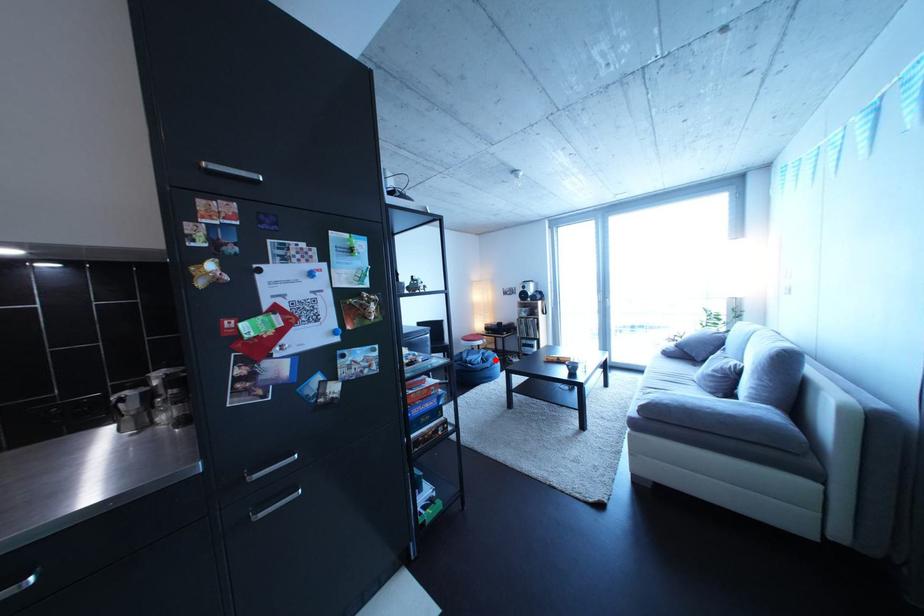
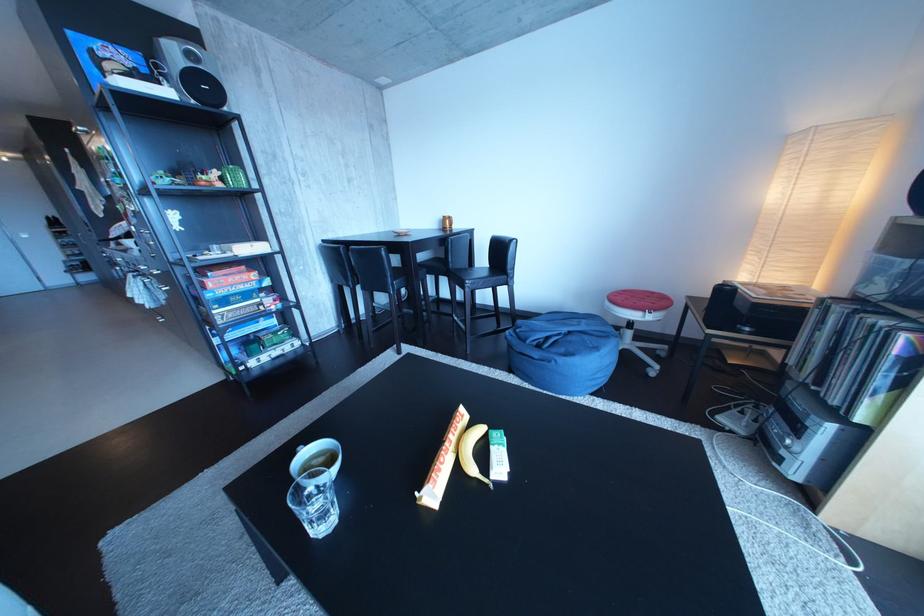
The point at the highlighted location is marked in the first image. Where is the corresponding point in the second image?

(582, 339)